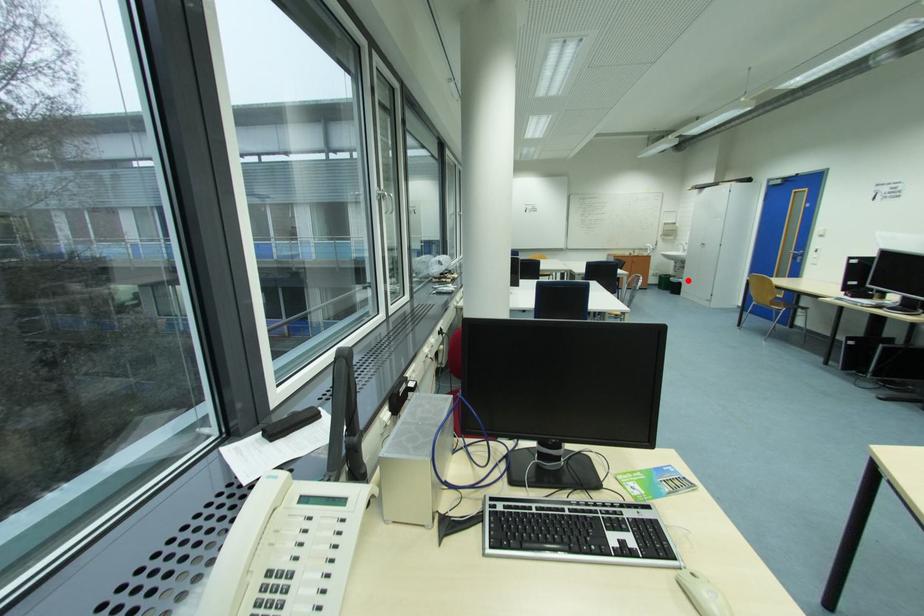
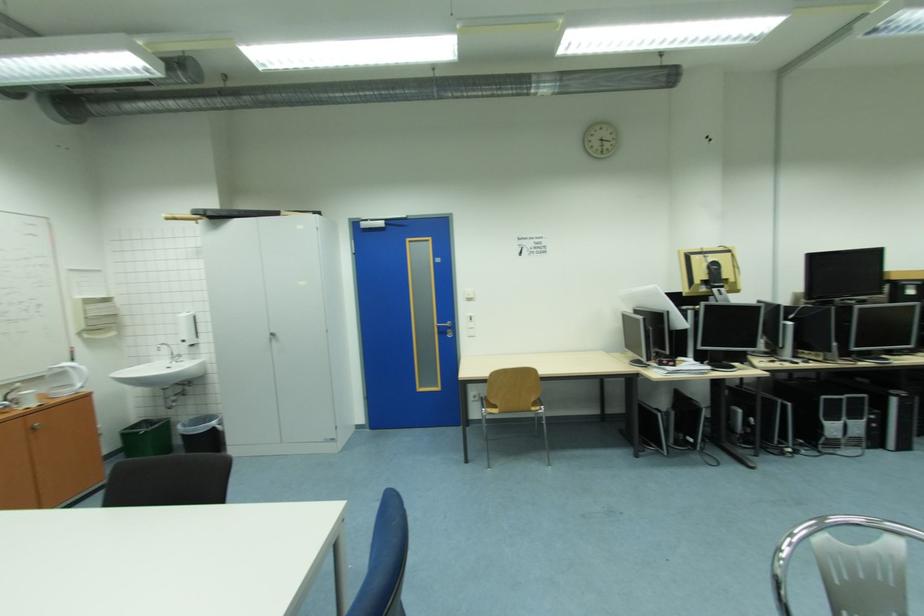
Find the pixel in the second image that matches the highlighted location in the first image.

(220, 424)